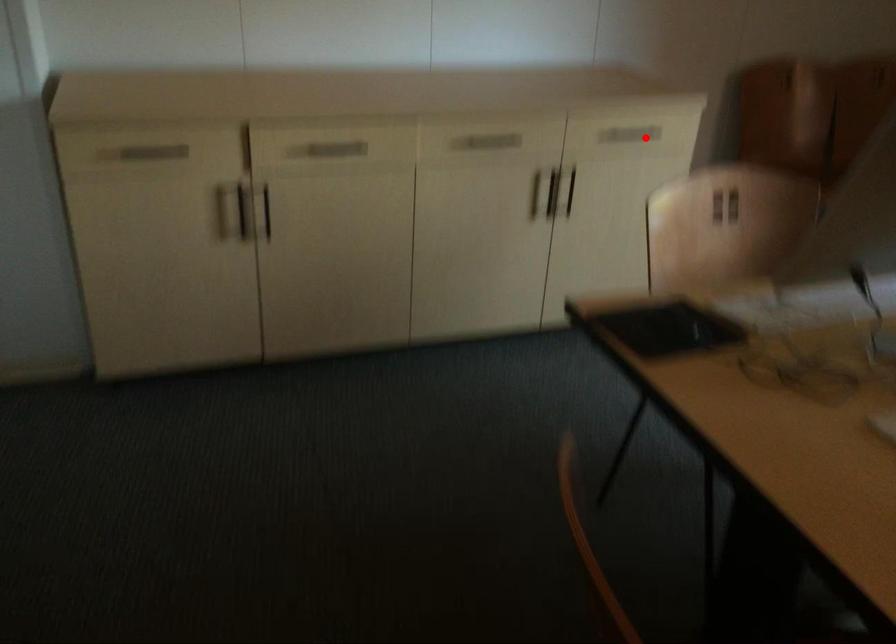
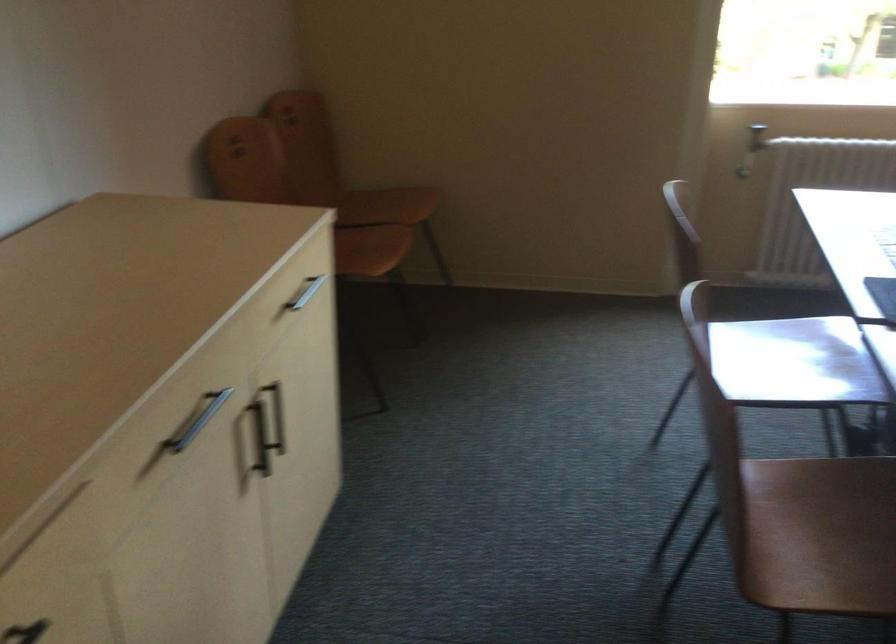
Find the pixel in the second image that matches the highlighted location in the first image.

(305, 292)